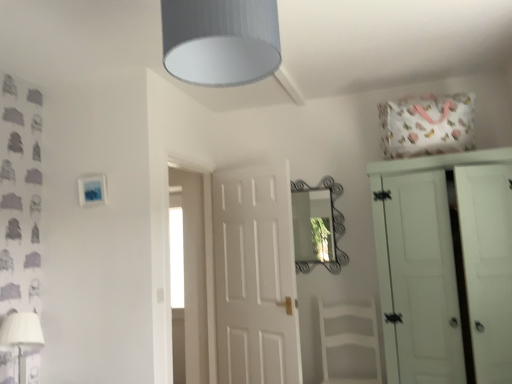
Question: Is white painted wood wardrobe at right outside gray textured lampshade at upper center?

Choices:
 (A) no
 (B) yes

Answer: (B)

Question: Is white painted wood wardrobe at right taller than gray textured lampshade at upper center?

Choices:
 (A) yes
 (B) no

Answer: (A)

Question: From the image's perspective, is white painted wood wardrobe at right on top of gray textured lampshade at upper center?

Choices:
 (A) yes
 (B) no

Answer: (B)

Question: Is white painted wood wardrobe at right thinner than gray textured lampshade at upper center?

Choices:
 (A) no
 (B) yes

Answer: (A)

Question: Is white painted wood wardrobe at right beside gray textured lampshade at upper center?

Choices:
 (A) no
 (B) yes

Answer: (A)

Question: In the image, is gray textured lampshade at upper center positioned in front of or behind white wood armchair at center?

Choices:
 (A) behind
 (B) front

Answer: (B)

Question: Looking at their shapes, would you say gray textured lampshade at upper center is wider or thinner than white wood armchair at center?

Choices:
 (A) wide
 (B) thin

Answer: (B)

Question: From a real-world perspective, is gray textured lampshade at upper center above or below white wood armchair at center?

Choices:
 (A) above
 (B) below

Answer: (A)

Question: Visually, is gray textured lampshade at upper center positioned to the left or to the right of white wood armchair at center?

Choices:
 (A) left
 (B) right

Answer: (A)

Question: Is white wood armchair at center bigger or smaller than gray textured lampshade at upper center?

Choices:
 (A) big
 (B) small

Answer: (A)

Question: From a real-world perspective, is white wood armchair at center physically located above or below gray textured lampshade at upper center?

Choices:
 (A) above
 (B) below

Answer: (B)

Question: From the image's perspective, is white wood armchair at center positioned above or below gray textured lampshade at upper center?

Choices:
 (A) below
 (B) above

Answer: (A)

Question: In the image, is white wood armchair at center on the left side or the right side of gray textured lampshade at upper center?

Choices:
 (A) right
 (B) left

Answer: (A)

Question: Is white painted wood wardrobe at right to the left or to the right of white wood armchair at center in the image?

Choices:
 (A) left
 (B) right

Answer: (B)

Question: From the image's perspective, is white painted wood wardrobe at right located above or below white wood armchair at center?

Choices:
 (A) above
 (B) below

Answer: (A)